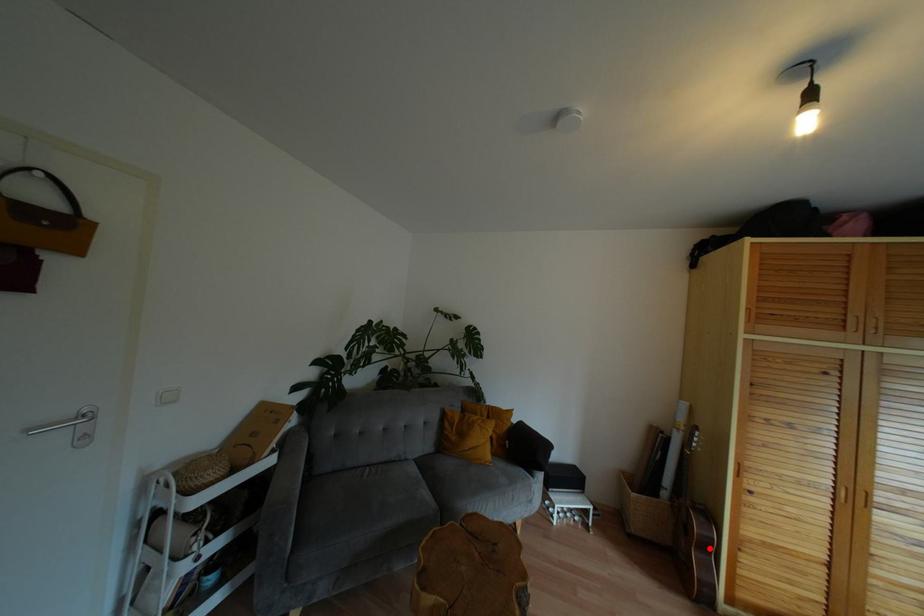
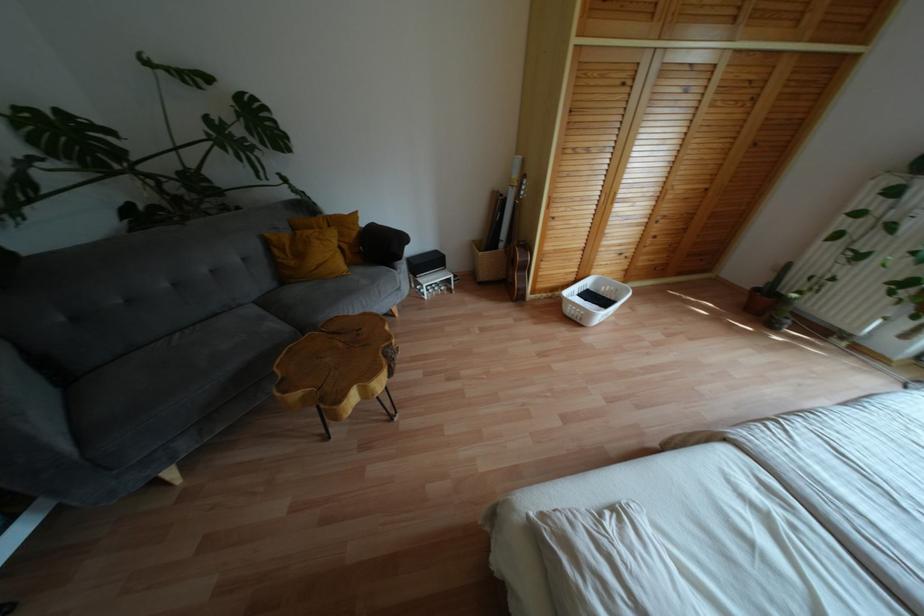
Question: I am providing you with two images of the same scene from different viewpoints. In image1, a red point is highlighted. Considering the same 3D point in image2, which of the following is correct?

Choices:
 (A) It is closer
 (B) It is farther

Answer: (B)